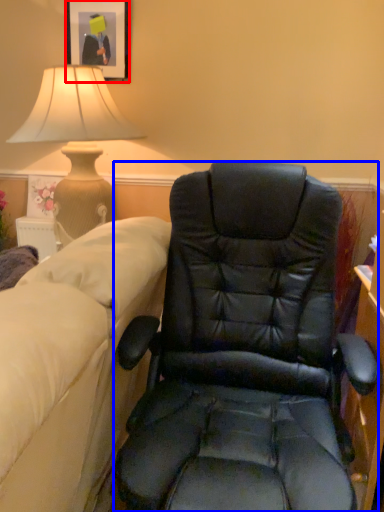
Question: Which object is closer to the camera taking this photo, picture frame (highlighted by a red box) or chair (highlighted by a blue box)?

Choices:
 (A) picture frame
 (B) chair

Answer: (B)